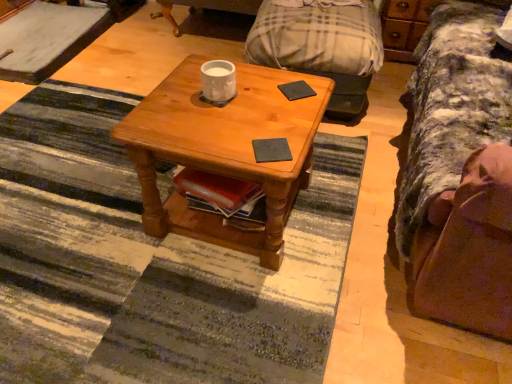
Question: Is brown fabric couch at right behind wooden dresser at upper right?

Choices:
 (A) no
 (B) yes

Answer: (A)

Question: Does brown fabric couch at right turn towards wooden dresser at upper right?

Choices:
 (A) no
 (B) yes

Answer: (A)

Question: Is brown fabric couch at right at the right side of wooden dresser at upper right?

Choices:
 (A) no
 (B) yes

Answer: (A)

Question: Does brown fabric couch at right lie in front of wooden dresser at upper right?

Choices:
 (A) no
 (B) yes

Answer: (B)

Question: Does brown fabric couch at right have a smaller size compared to wooden dresser at upper right?

Choices:
 (A) yes
 (B) no

Answer: (B)

Question: Does brown fabric couch at right appear on the left side of wooden dresser at upper right?

Choices:
 (A) yes
 (B) no

Answer: (A)

Question: Can you confirm if white glossy mug at center is positioned to the left of wooden coffee table at center?

Choices:
 (A) no
 (B) yes

Answer: (B)

Question: Is white glossy mug at center facing towards wooden coffee table at center?

Choices:
 (A) no
 (B) yes

Answer: (A)

Question: Is wooden coffee table at center at the back of white glossy mug at center?

Choices:
 (A) no
 (B) yes

Answer: (A)

Question: From the image's perspective, is white glossy mug at center located above wooden coffee table at center?

Choices:
 (A) no
 (B) yes

Answer: (B)

Question: Is white glossy mug at center positioned in front of wooden coffee table at center?

Choices:
 (A) yes
 (B) no

Answer: (B)

Question: Does white glossy mug at center appear on the right side of wooden coffee table at center?

Choices:
 (A) no
 (B) yes

Answer: (A)

Question: Is black matte pad at center, which is the second pad from back to front, a part of white glossy mug at center?

Choices:
 (A) yes
 (B) no

Answer: (B)